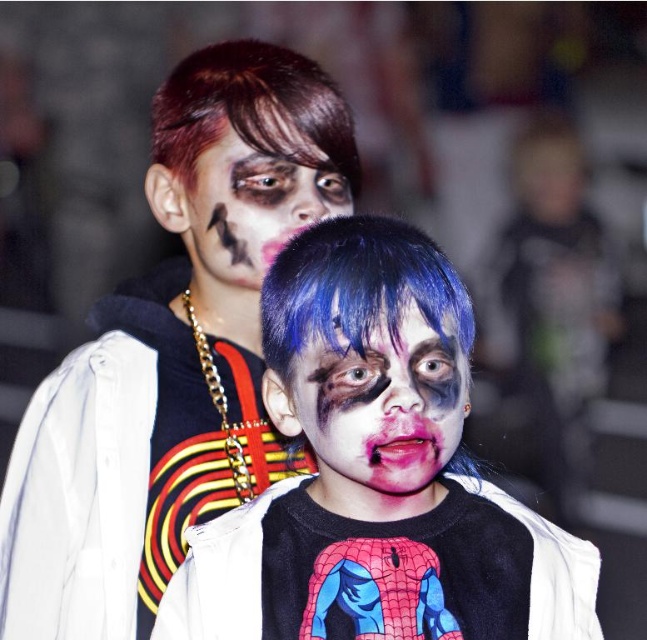
You are taking a photo of two people in zombie costumes. You notice two points in the image at coordinates point (314, 204) and point (378, 451). Which point is closer to the camera?

Point (314, 204) is further to the camera than point (378, 451), so the point closer to the camera is point (378, 451).

Based on the photo, you are taking a photo of two people in zombie costumes. You notice two points marked on the image, one at coordinates point (344, 336) and another at point (562, 538). Which point is nearer to the camera?

Point (344, 336) is closer to the camera than point (562, 538).